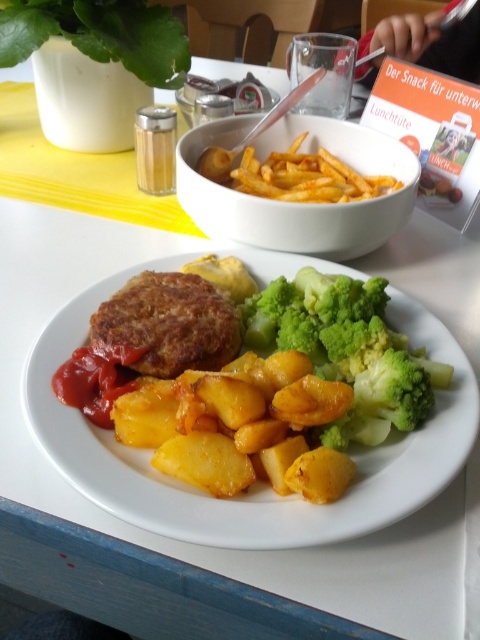
You are a food delivery robot with a 16 inch wide tray. You need to pick up the brown crispy patty at center and the green leafy vegetable at upper left and deliver them together. Can your tray hold both items without overlapping?

The distance between the brown crispy patty at center and the green leafy vegetable at upper left is 17.64 inches. Since your tray is only 16 inches wide, the items would overlap when placed side by side, so they cannot be placed together on the tray without overlapping.

You are a food critic analyzing the spatial arrangement of this meal. The plate has a coordinate system where the bottom left corner is the origin point. Where is the green broccoli at center located in terms of coordinates?

The green broccoli at center is located at coordinates point (348, 349).

You are a food critic sitting at the table. You want to reach for the green broccoli at center and the green leafy vegetable at upper left. Which one is closer to you?

The green broccoli at center is closer to you because it is in front of the green leafy vegetable at upper left.